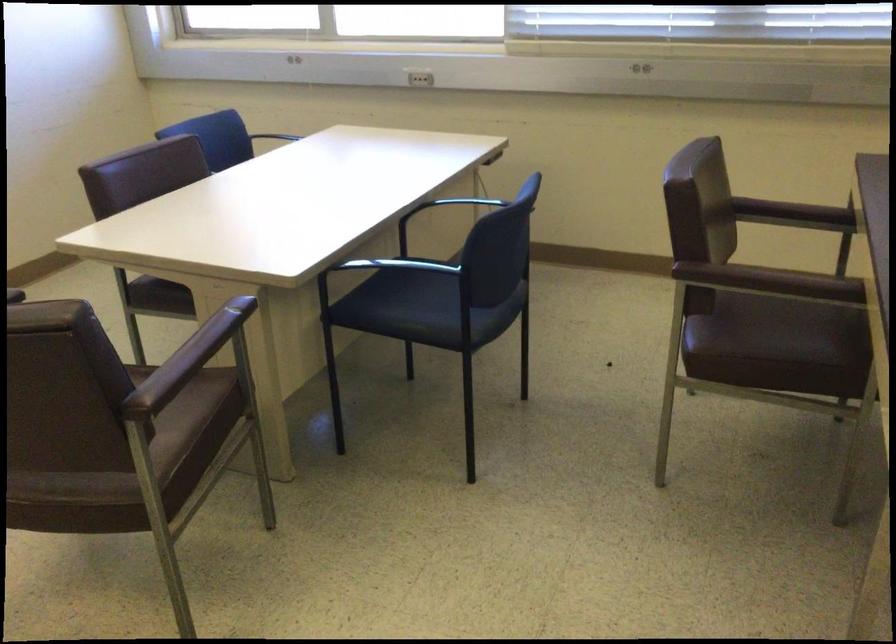
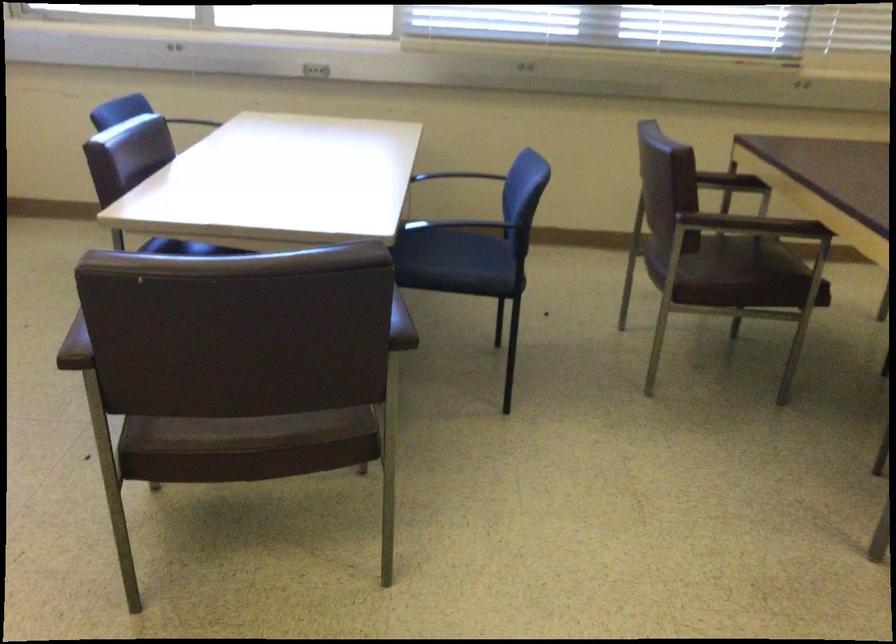
Where in the second image is the point corresponding to point 309,126 from the first image?

(202, 120)